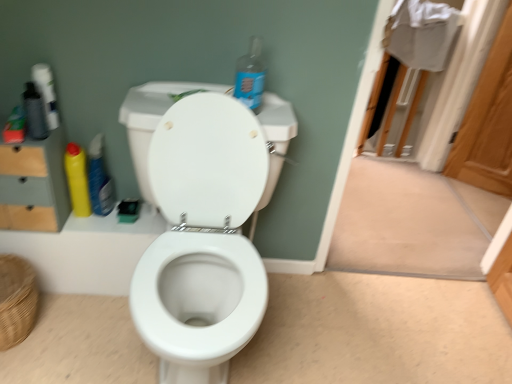
Where is `free location above wooden dresser at left (from a real-world perspective)`? free location above wooden dresser at left (from a real-world perspective) is located at coordinates (17, 129).